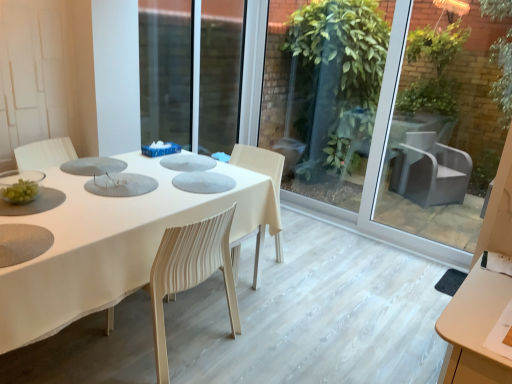
Based on the photo, what is the approximate height of transparent glass door at center?

It is 6.08 feet.

Describe the element at coordinates (393, 127) in the screenshot. The width and height of the screenshot is (512, 384). I see `transparent glass door at center` at that location.

This screenshot has width=512, height=384. What are the coordinates of `white fabric table at center` in the screenshot? It's located at (115, 245).

Locate an element on the screen. The width and height of the screenshot is (512, 384). white striped fabric chair at center is located at coordinates (190, 273).

Locate an element on the screen. The width and height of the screenshot is (512, 384). chair that appears below the white fabric table at center (from the image's perspective) is located at coordinates (190, 273).

Based on the photo, which is more to the right, white striped fabric chair at center or white fabric table at center?

white striped fabric chair at center is more to the right.

Considering the relative sizes of white striped fabric chair at center and white fabric table at center in the image provided, is white striped fabric chair at center wider than white fabric table at center?

No.

Is white striped fabric chair at center taller than white fabric table at center?

Correct, white striped fabric chair at center is much taller as white fabric table at center.

Is transparent glass door at center far from white striped fabric chair at center?

transparent glass door at center is positioned a significant distance from white striped fabric chair at center.

Which object is positioned more to the right, transparent glass door at center or white striped fabric chair at center?

transparent glass door at center.

Is transparent glass door at center positioned before white striped fabric chair at center?

No, transparent glass door at center is further to the viewer.

Considering the sizes of objects transparent glass door at center and white striped fabric chair at center in the image provided, who is taller, transparent glass door at center or white striped fabric chair at center?

transparent glass door at center is taller.

Find the location of a particular element. Image resolution: width=512 pixels, height=384 pixels. glass door that is on the right side of white fabric table at center is located at coordinates (393, 127).

From the picture: From a real-world perspective, is transparent glass door at center above or below white fabric table at center?

Clearly, from a real-world perspective, transparent glass door at center is above white fabric table at center.

From the image's perspective, between transparent glass door at center and white fabric table at center, who is located below?

white fabric table at center appears lower in the image.

From a real-world perspective, is white fabric table at center located beneath white striped fabric chair at center?

Yes, from a real-world perspective, white fabric table at center is under white striped fabric chair at center.

Does white fabric table at center have a smaller size compared to white striped fabric chair at center?

Actually, white fabric table at center might be larger than white striped fabric chair at center.

Is the position of white fabric table at center more distant than that of white striped fabric chair at center?

No, white fabric table at center is closer to the camera.

Is white fabric table at center next to white striped fabric chair at center and touching it?

No, white fabric table at center is not in contact with white striped fabric chair at center.

At what (x,y) coordinates should I click in order to perform the action: click on glass door on the right of white fabric table at center. Please return your answer as a coordinate pair (x, y). The image size is (512, 384). Looking at the image, I should click on [393, 127].

Between white fabric table at center and transparent glass door at center, which one appears on the left side from the viewer's perspective?

white fabric table at center is more to the left.

Considering the sizes of objects white fabric table at center and transparent glass door at center in the image provided, who is smaller, white fabric table at center or transparent glass door at center?

transparent glass door at center is smaller.

Is white fabric table at center not close to transparent glass door at center?

That's right, there is a large distance between white fabric table at center and transparent glass door at center.

Can transparent glass door at center be found inside white striped fabric chair at center?

Actually, transparent glass door at center is outside white striped fabric chair at center.

Is white striped fabric chair at center in front of or behind transparent glass door at center in the image?

In the image, white striped fabric chair at center appears in front of transparent glass door at center.

From the image's perspective, is white striped fabric chair at center below transparent glass door at center?

Indeed, from the image's perspective, white striped fabric chair at center is shown beneath transparent glass door at center.

Is white striped fabric chair at center oriented towards transparent glass door at center?

No, white striped fabric chair at center is not aimed at transparent glass door at center.

Locate an element on the screen. This screenshot has height=384, width=512. table lying above the white striped fabric chair at center (from the image's perspective) is located at coordinates (115, 245).

I want to click on chair below the transparent glass door at center (from a real-world perspective), so click(x=190, y=273).

Which object lies nearer to the anchor point white striped fabric chair at center, transparent glass door at center or white fabric table at center?

Among the two, white fabric table at center is located nearer to white striped fabric chair at center.

Looking at the image, which one is located closer to white striped fabric chair at center, white fabric table at center or transparent glass door at center?

white fabric table at center is closer to white striped fabric chair at center.

Based on their spatial positions, is white fabric table at center or white striped fabric chair at center closer to transparent glass door at center?

Among the two, white fabric table at center is located nearer to transparent glass door at center.

Based on their spatial positions, is white striped fabric chair at center or white fabric table at center further from transparent glass door at center?

Among the two, white striped fabric chair at center is located further to transparent glass door at center.

Considering their positions, is white striped fabric chair at center positioned closer to white fabric table at center than transparent glass door at center?

Among the two, white striped fabric chair at center is located nearer to white fabric table at center.

From the image, which object appears to be farther from white fabric table at center, transparent glass door at center or white striped fabric chair at center?

transparent glass door at center is positioned further to the anchor white fabric table at center.

You are a GUI agent. You are given a task and a screenshot of the screen. Output one action in this format:
    pyautogui.click(x=<x>, y=<y>)
    Task: Click on the chair between white fabric table at center and transparent glass door at center
    The image size is (512, 384).
    Given the screenshot: What is the action you would take?
    pyautogui.click(x=190, y=273)